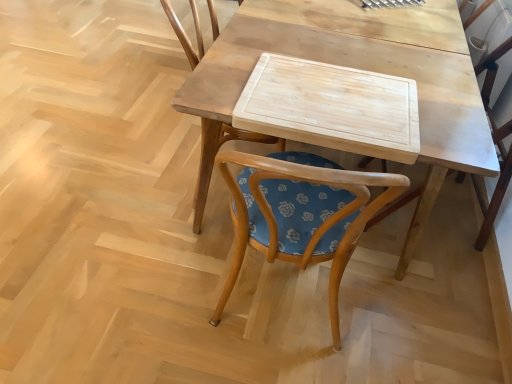
Identify the location of free space above natural wood cutting board at center (from a real-world perspective). The height and width of the screenshot is (384, 512). (343, 99).